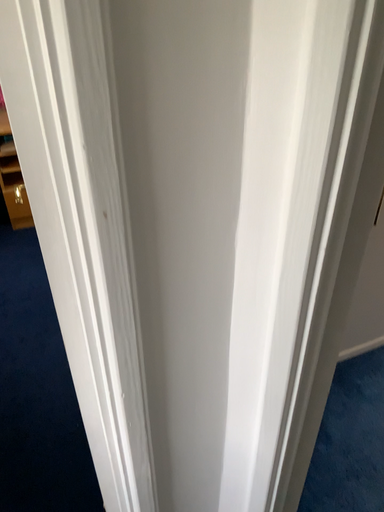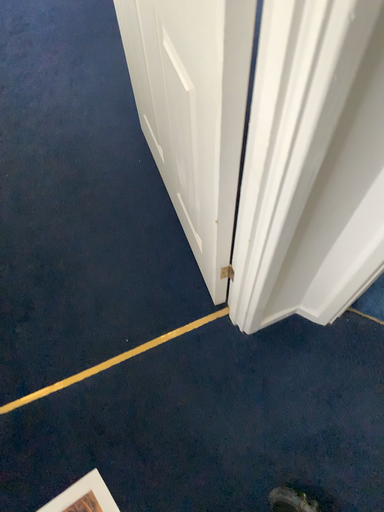
Question: Which way did the camera rotate in the video?

Choices:
 (A) rotated upward
 (B) rotated downward

Answer: (B)